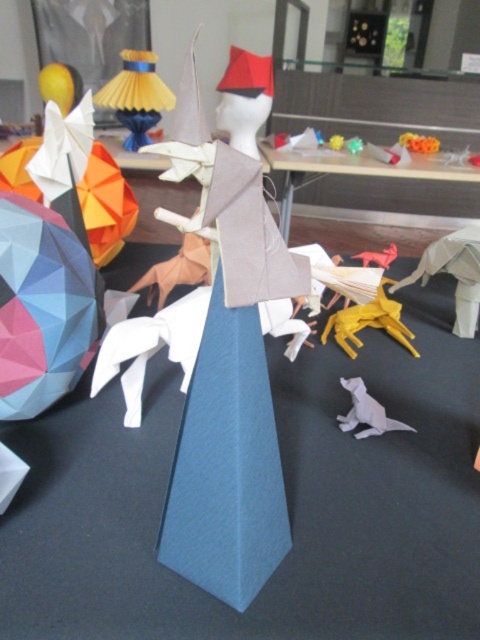
You are arranging origami art pieces on a dark surface. You have a wooden table at center and a yellow paper horse at center. Which object is positioned to the right of the other?

The wooden table at center is to the right of the yellow paper horse at center.

You are placing a glass on the wooden table at center. The glass is 1 foot in diameter. Will it fit on the table?

The glass is 1 foot in diameter and the wooden table at center has a diameter of 4.29 feet. Since the glass is smaller than the table, it will fit.